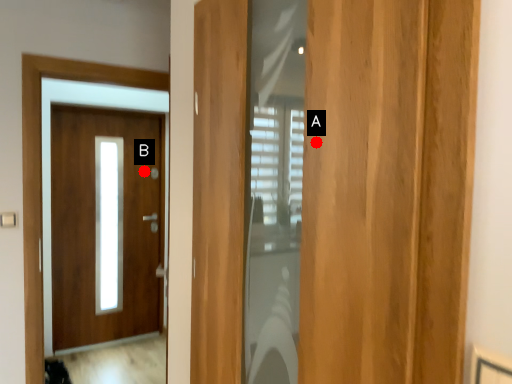
Question: Two points are circled on the image, labeled by A and B beside each circle. Which point appears farthest from the camera in this image?

Choices:
 (A) A is further
 (B) B is further

Answer: (B)